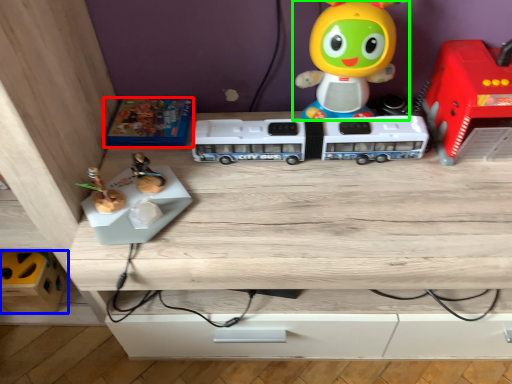
Question: Based on their relative distances, which object is farther from toy (highlighted by a red box)? Choose from toy (highlighted by a blue box) and toy (highlighted by a green box).

Choices:
 (A) toy
 (B) toy

Answer: (A)